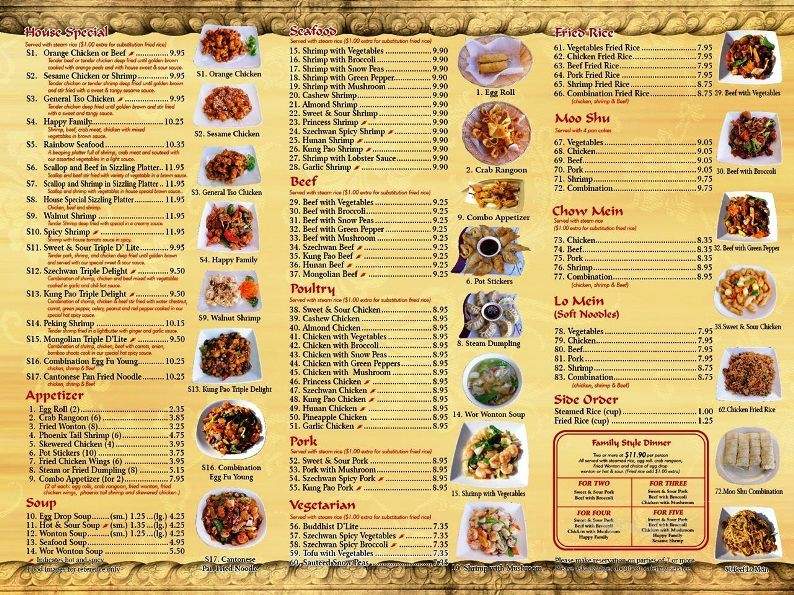
You are a GUI agent. You are given a task and a screenshot of the screen. Output one action in this format:
    pyautogui.click(x=<x>, y=<y>)
    Task: Click on the circular plates
    This screenshot has height=595, width=794.
    Given the screenshot: What is the action you would take?
    pyautogui.click(x=249, y=450), pyautogui.click(x=257, y=506), pyautogui.click(x=515, y=158), pyautogui.click(x=526, y=64), pyautogui.click(x=773, y=308), pyautogui.click(x=750, y=477)